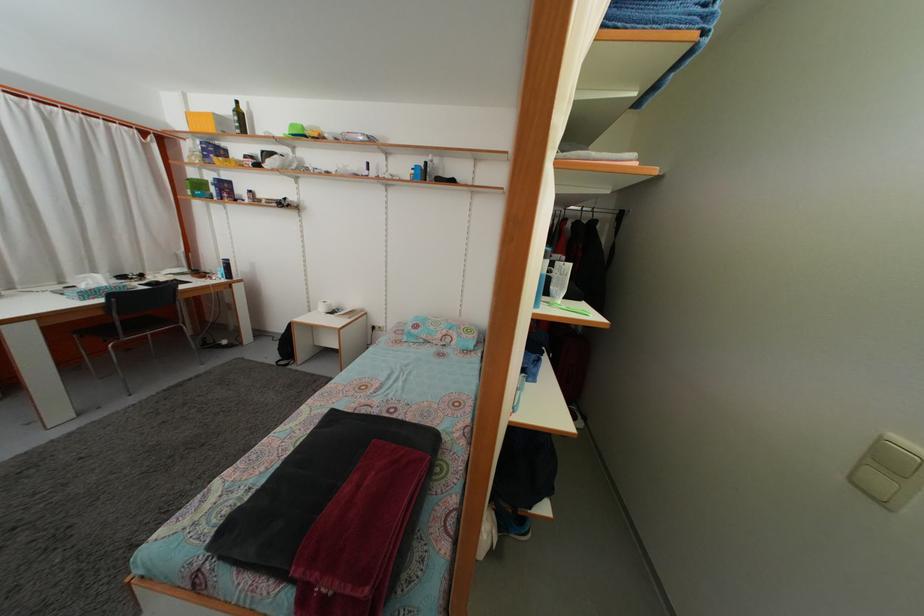
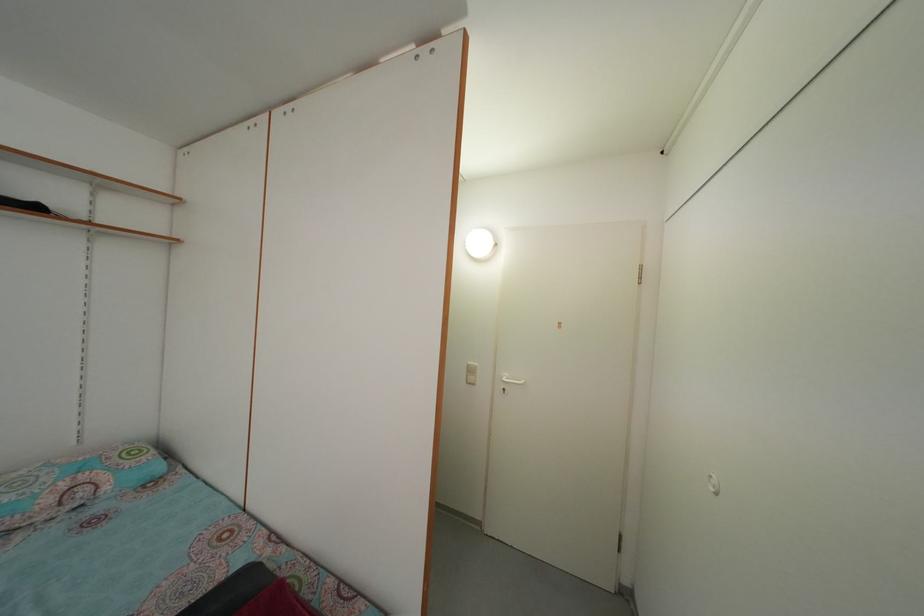
Question: The first image is from the beginning of the video and the second image is from the end. How did the camera likely rotate when shooting the video?

Choices:
 (A) Left
 (B) Right
 (C) Up
 (D) Down

Answer: (B)